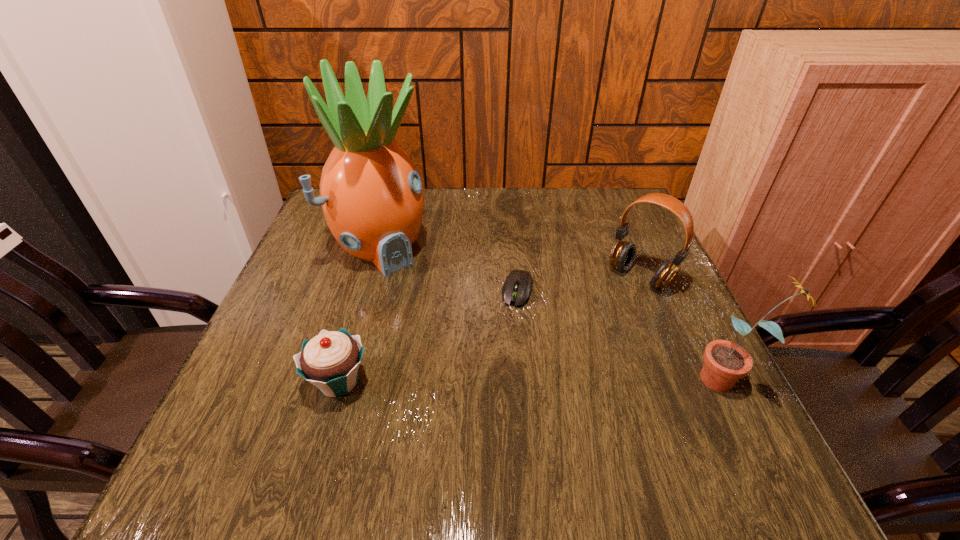
Identify the location of free space on the desktop that is between the cupcake and the sunflower and is positioned at the entrance of the pineapple. This screenshot has height=540, width=960. (503, 381).

I want to click on vacant space on the desktop that is between the cupcake and the sunflower and is positioned on the ear cups of the headset, so click(540, 380).

You are a GUI agent. You are given a task and a screenshot of the screen. Output one action in this format:
    pyautogui.click(x=<x>, y=<y>)
    Task: Click on the free spot on the desktop that is between the cupcake and the sunflower and is positioned on the wheel side of the shortest object
    The image size is (960, 540).
    Given the screenshot: What is the action you would take?
    pyautogui.click(x=491, y=381)